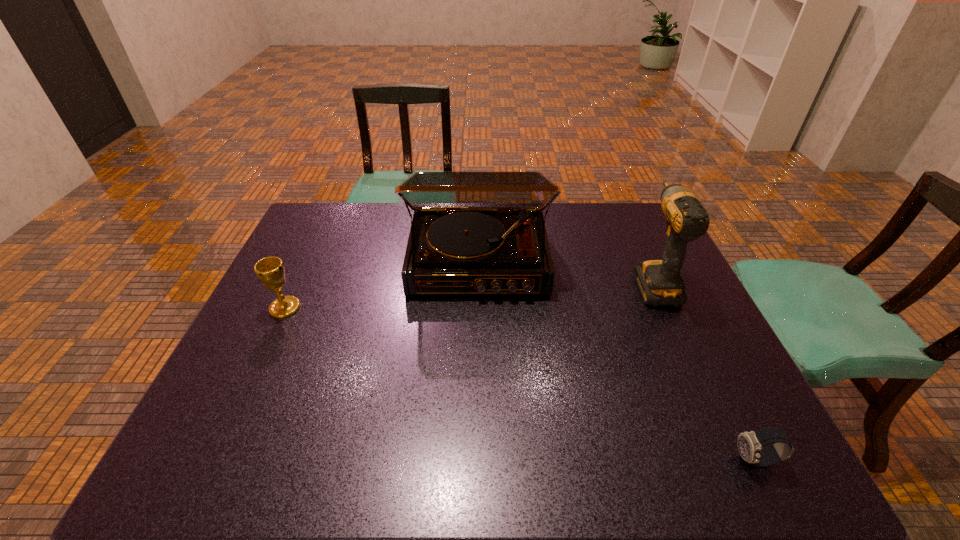
Identify the location of vacant point located 0.370m on the front of the leftmost object. The height and width of the screenshot is (540, 960). (218, 451).

This screenshot has height=540, width=960. I want to click on vacant space located on the face of the nearest object, so click(555, 461).

Where is `free point located 0.170m on the face of the nearest object`? The image size is (960, 540). free point located 0.170m on the face of the nearest object is located at coordinates click(650, 461).

At what (x,y) coordinates should I click in order to perform the action: click on vacant space located 0.120m on the face of the nearest object. Please return your answer as a coordinate pair (x, y). The image size is (960, 540). Looking at the image, I should click on (675, 461).

This screenshot has width=960, height=540. In order to click on object that is at the far edge in this screenshot , I will do `click(473, 232)`.

Locate an element on the screen. object located at the near edge is located at coordinates (750, 444).

Identify the location of object that is positioned at the left edge. This screenshot has height=540, width=960. (270, 270).

Locate an element on the screen. The width and height of the screenshot is (960, 540). drill at the right edge is located at coordinates (660, 283).

The height and width of the screenshot is (540, 960). What are the coordinates of `watch that is positioned at the right edge` in the screenshot? It's located at [x=750, y=444].

Identify the location of object at the near right corner. (750, 444).